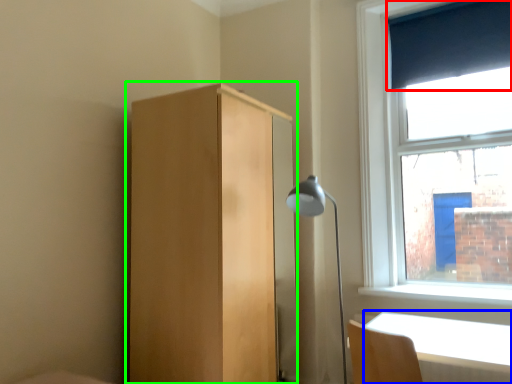
Question: Which object is the farthest from curtain (highlighted by a red box)? Choose among these: table (highlighted by a blue box) or dresser (highlighted by a green box).

Choices:
 (A) table
 (B) dresser

Answer: (A)